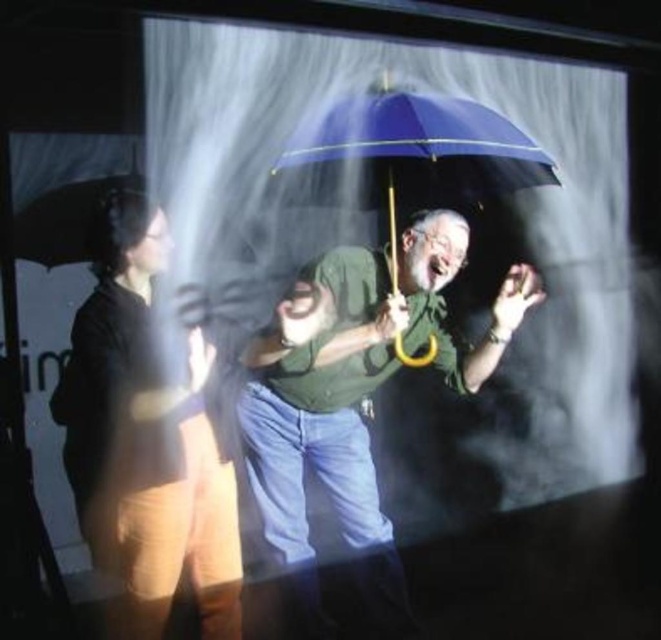
You are standing at the center of the scene. You want to move towards the blue umbrella held by Person 2 on the right. There are two points marked in the scene at coordinates point [438,266] and point [346,140]. Which point should you avoid stepping on to ensure you can reach the blue umbrella without obstruction?

You should avoid stepping on point [438,266] because it is behind point [346,140], which might block your path towards the blue umbrella held by Person 2 on the right.

Based on the photo, you are a photographer trying to capture both the matte green shirt at center and the matte black jacket at left in a single frame. Based on their positions, which one should you focus on first to ensure both are in the frame?

The matte green shirt at center is positioned on the right side of the matte black jacket at left, so you should focus on the matte black jacket at left first to ensure both are in the frame.